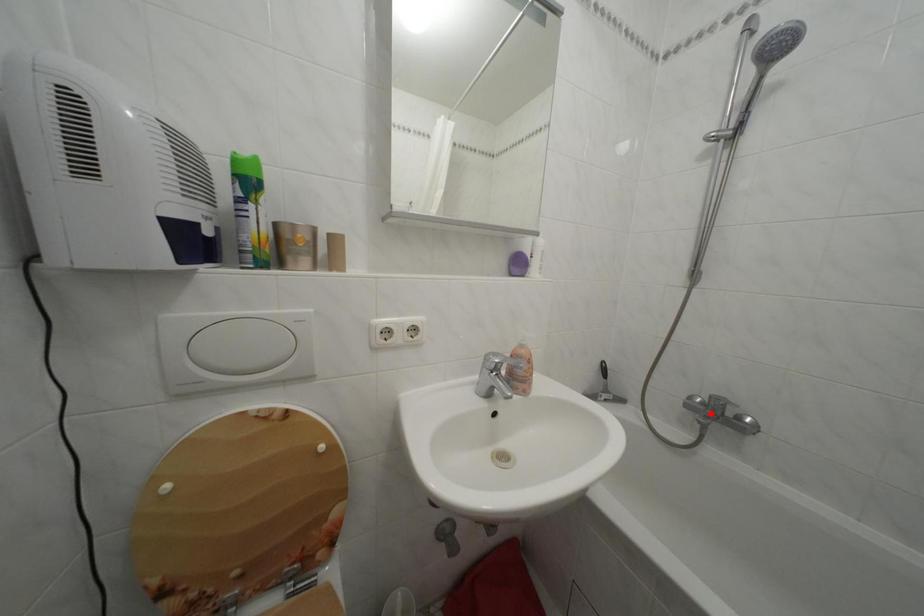
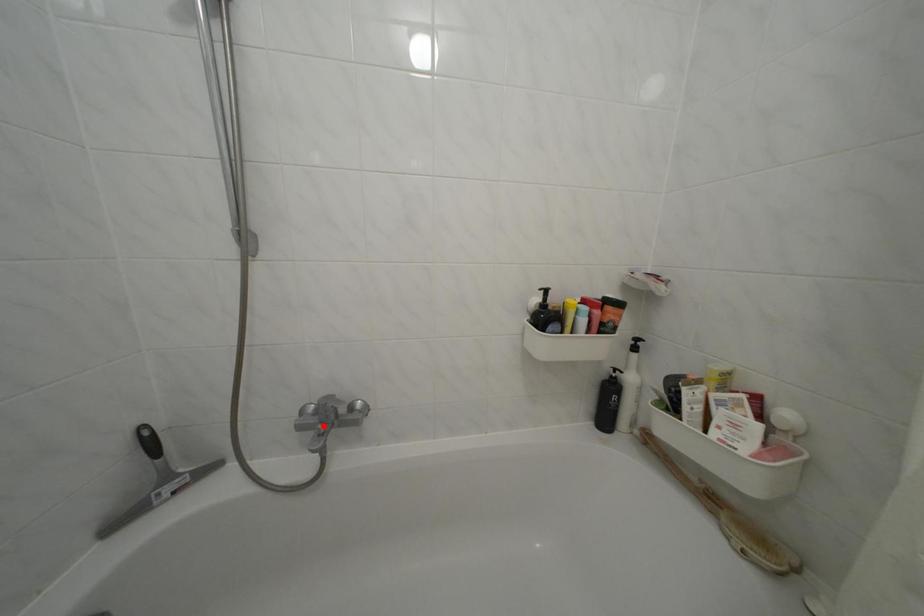
I am providing you with two images of the same scene from different viewpoints. A red point is marked on the first image and another point is marked on the second image. Are the points marked in image1 and image2 representing the same 3D position?

Yes